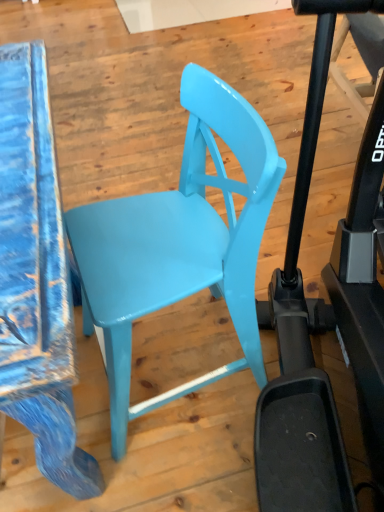
Describe the element at coordinates (180, 243) in the screenshot. This screenshot has height=512, width=384. I see `matte blue chair at center` at that location.

Measure the distance between matte blue chair at center and camera.

matte blue chair at center is 23.59 inches from camera.

You are a GUI agent. You are given a task and a screenshot of the screen. Output one action in this format:
    pyautogui.click(x=<x>, y=<y>)
    Task: Click on the matte blue chair at center
    The image size is (384, 512).
    Given the screenshot: What is the action you would take?
    pyautogui.click(x=180, y=243)

Locate an element on the screen. The height and width of the screenshot is (512, 384). matte blue chair at center is located at coordinates (180, 243).